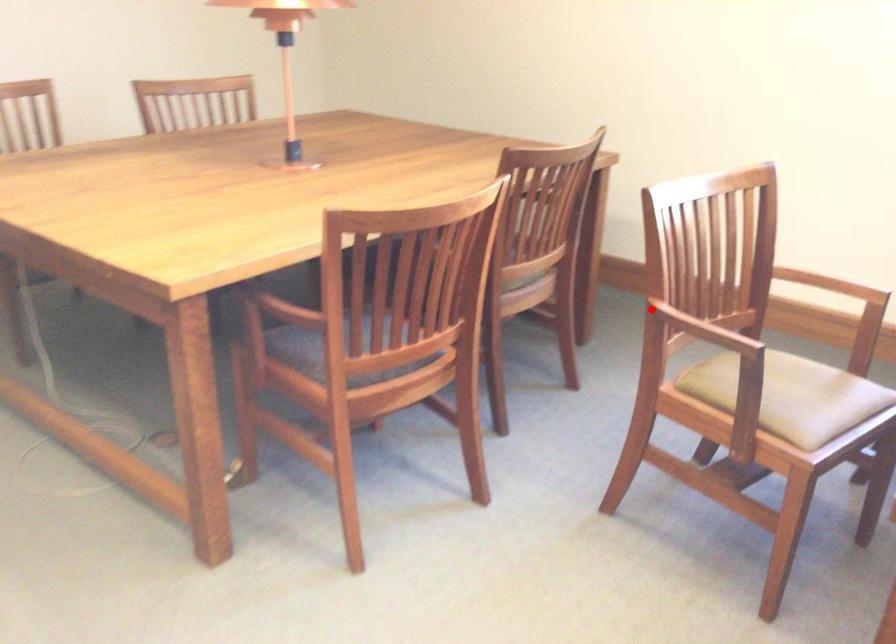
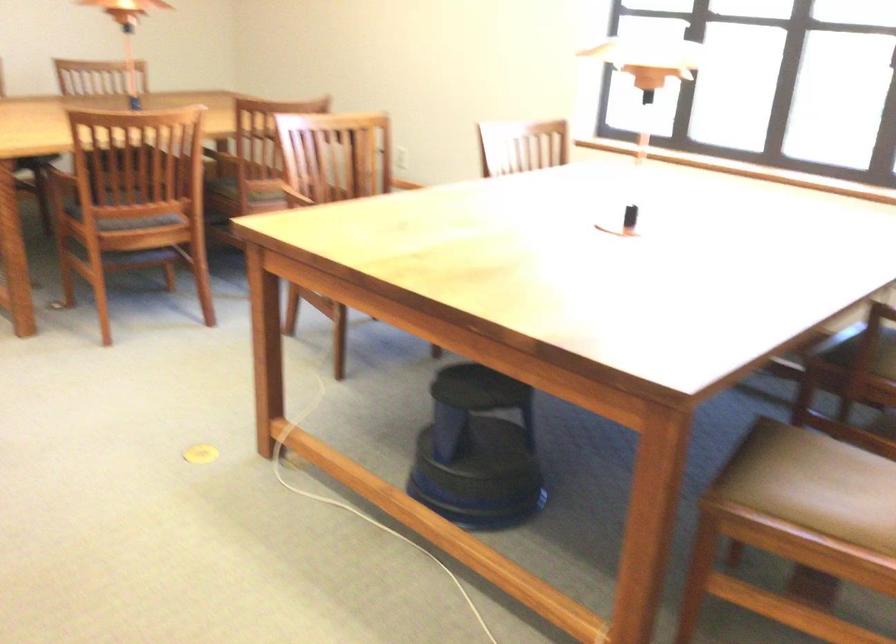
The point at the highlighted location is marked in the first image. Where is the corresponding point in the second image?

(303, 194)